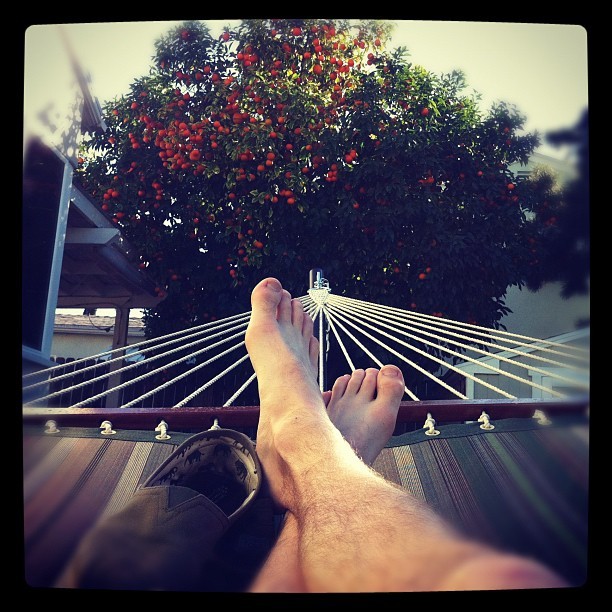
This screenshot has width=612, height=612. In order to click on homes in this screenshot , I will do `click(65, 340)`, `click(24, 365)`, `click(535, 289)`.